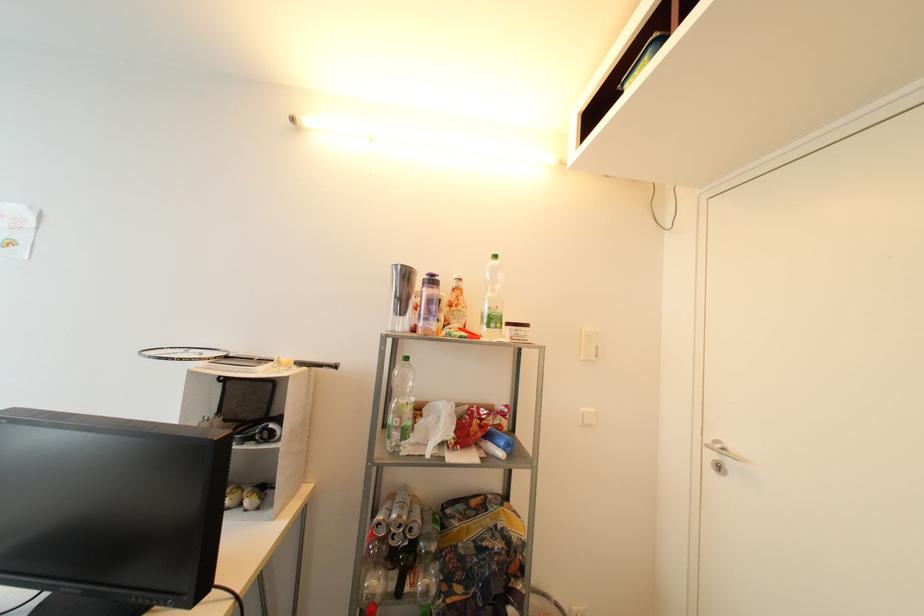
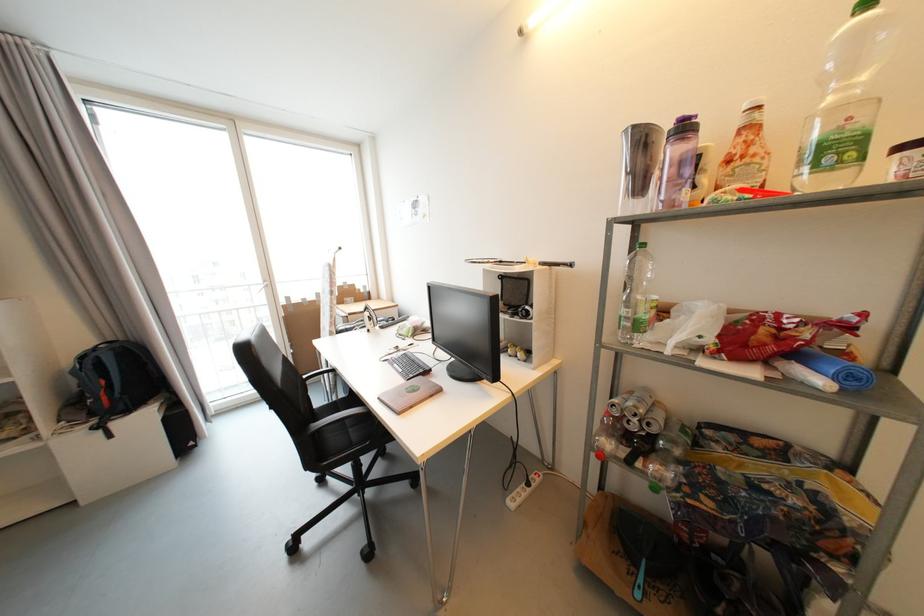
Find the pixel in the second image that matches point 462,307 in the first image.

(748, 159)